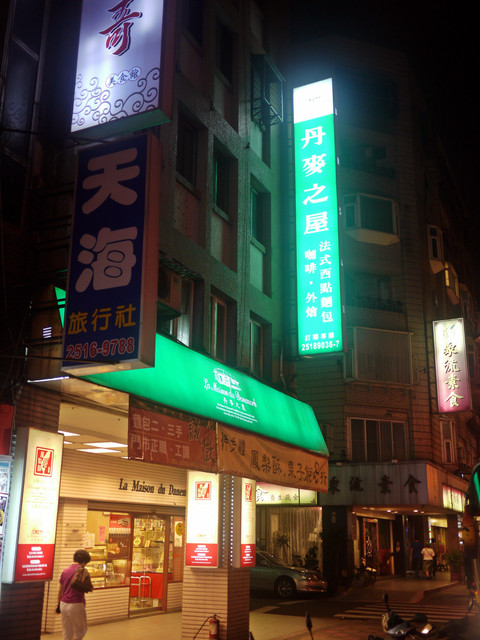
This screenshot has height=640, width=480. I want to click on door, so click(150, 557), click(371, 538).